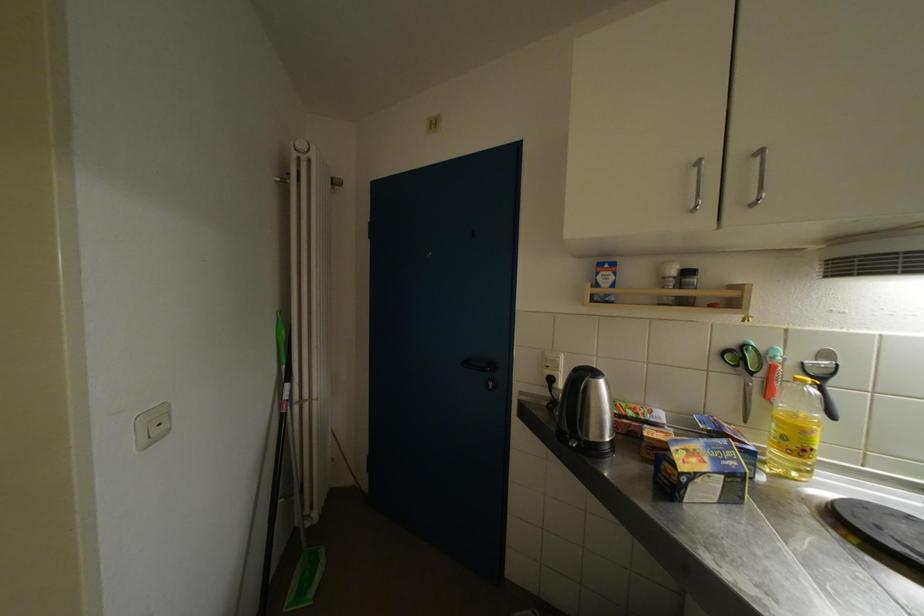
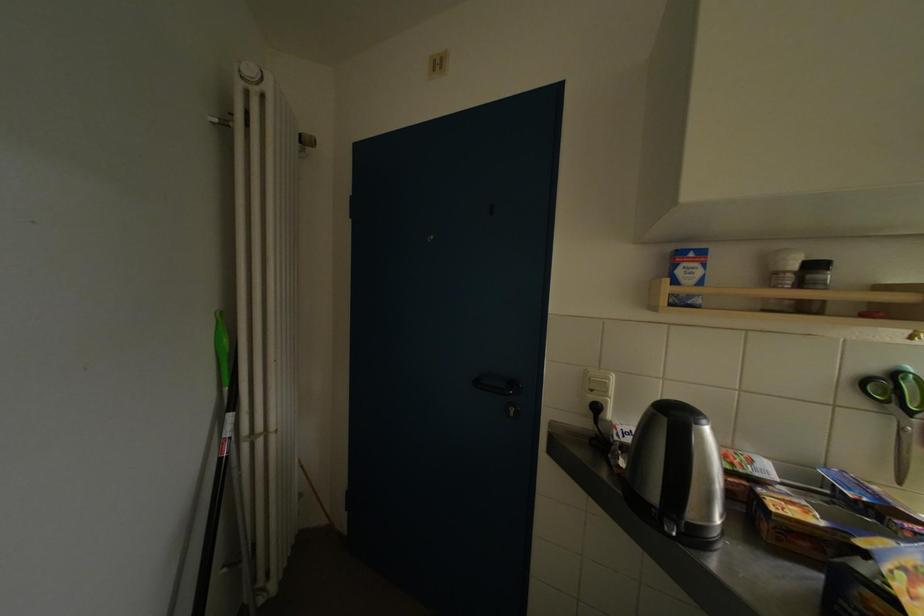
Find the pixel in the second image that matches the point at 671,282 in the first image.

(784, 277)